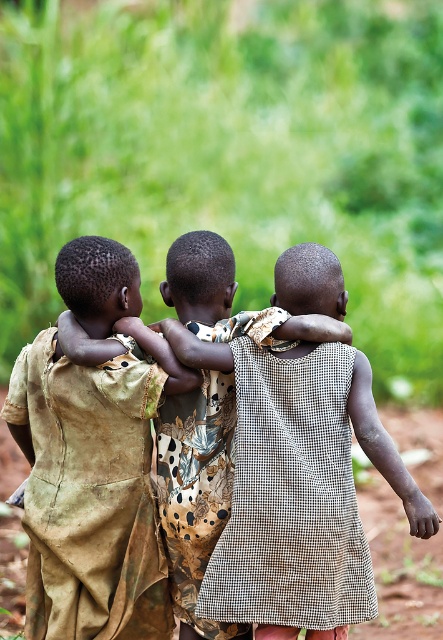
Question: Which point appears closest to the camera in this image?

Choices:
 (A) (213, 353)
 (B) (418, 582)
 (C) (155, 579)

Answer: (A)

Question: Does brown textured cloth at center have a larger size compared to brown dirt field at lower center?

Choices:
 (A) no
 (B) yes

Answer: (A)

Question: In this image, where is brown textured cloth at center located relative to brown dirt field at lower center?

Choices:
 (A) above
 (B) below

Answer: (A)

Question: Which object is closer to the camera taking this photo?

Choices:
 (A) brown dirt field at lower center
 (B) brown textured cloth at center
 (C) checkered fabric dress at center

Answer: (C)

Question: Which of the following is the closest to the observer?

Choices:
 (A) brown textured cloth at center
 (B) checkered fabric dress at center

Answer: (B)

Question: Is brown textured cloth at center positioned in front of brown dirt field at lower center?

Choices:
 (A) yes
 (B) no

Answer: (A)